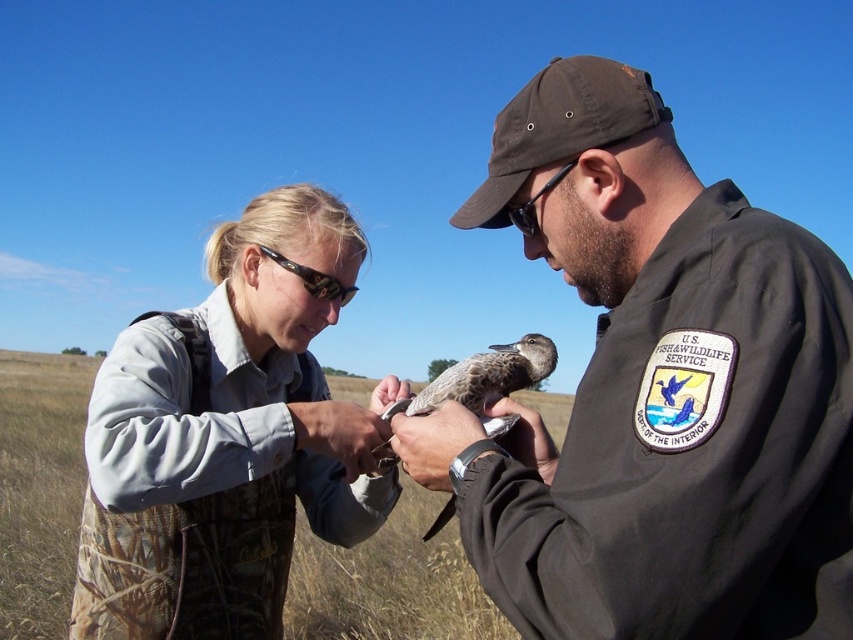
Is camo-patterned waders at center below tortoiseshell plastic goggles at upper center?

Indeed, camo-patterned waders at center is positioned under tortoiseshell plastic goggles at upper center.

Does camo-patterned waders at center appear on the right side of tortoiseshell plastic goggles at upper center?

Incorrect, camo-patterned waders at center is not on the right side of tortoiseshell plastic goggles at upper center.

Describe the element at coordinates (225, 440) in the screenshot. I see `camo-patterned waders at center` at that location.

What are the coordinates of `camo-patterned waders at center` in the screenshot? It's located at (225, 440).

Between speckled feathered duckling at center and black plastic goggles at center, which one is positioned lower?

Positioned lower is speckled feathered duckling at center.

Can you confirm if speckled feathered duckling at center is positioned above black plastic goggles at center?

No.

Locate an element on the screen. The image size is (853, 640). speckled feathered duckling at center is located at coordinates (485, 380).

Where is `speckled feathered duckling at center`? This screenshot has width=853, height=640. speckled feathered duckling at center is located at coordinates (485, 380).

Is point (216, 285) farther from camera compared to point (532, 196)?

That is True.

In order to click on camo-patterned waders at center in this screenshot , I will do `click(225, 440)`.